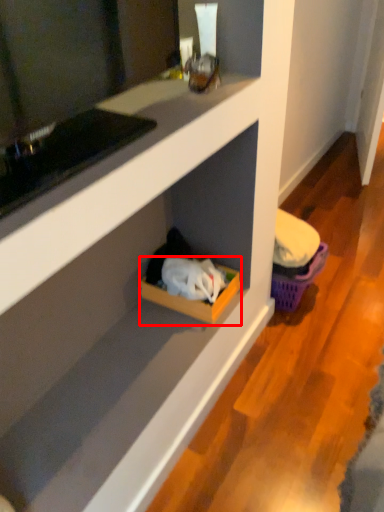
Question: From the image, what is the correct spatial relationship of storage box (annotated by the red box) in relation to basket?

Choices:
 (A) right
 (B) left

Answer: (B)